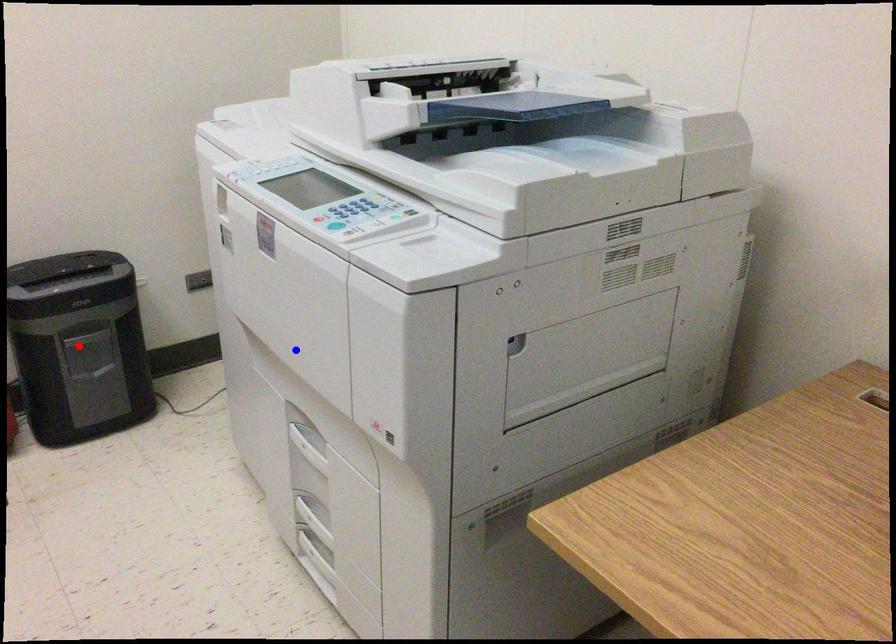
Question: In the image, two points are highlighted. Which point is nearer to the camera? Reply with the corresponding letter.

Choices:
 (A) blue point
 (B) red point

Answer: (A)